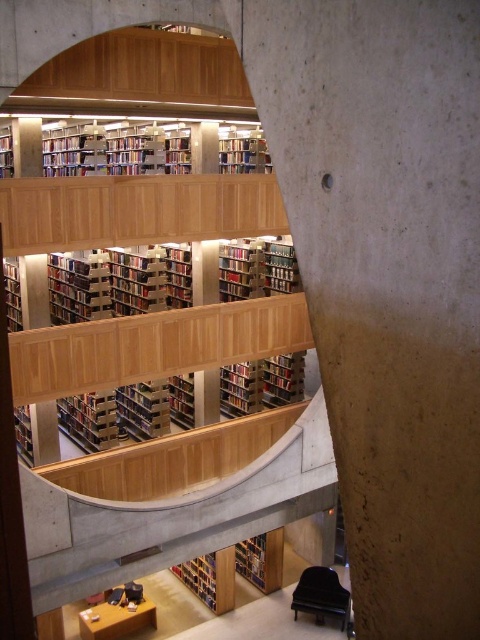
Between wooden bookshelf at lower center and hardcover book at lower center, which one has less height?

With less height is wooden bookshelf at lower center.

Does wooden bookshelf at lower center have a greater width compared to hardcover book at lower center?

Correct, the width of wooden bookshelf at lower center exceeds that of hardcover book at lower center.

Where is `wooden bookshelf at lower center`? wooden bookshelf at lower center is located at coordinates (200, 577).

Who is lower down, wooden bookcase at upper center or hardcover book at lower center?

Positioned lower is hardcover book at lower center.

Is point (175, 280) less distant than point (252, 577)?

Yes, it is in front of point (252, 577).

Where is `wooden bookcase at upper center`? Image resolution: width=480 pixels, height=640 pixels. wooden bookcase at upper center is located at coordinates (149, 244).

Between point (181, 282) and point (208, 593), which one is positioned behind?

Positioned behind is point (181, 282).

Does point (268, 291) come behind point (199, 572)?

That is True.

You are a GUI agent. You are given a task and a screenshot of the screen. Output one action in this format:
    pyautogui.click(x=<x>, y=<y>)
    Task: Click on the wooden bookcase at upper center
    This screenshot has width=480, height=640.
    Given the screenshot: What is the action you would take?
    pyautogui.click(x=149, y=244)